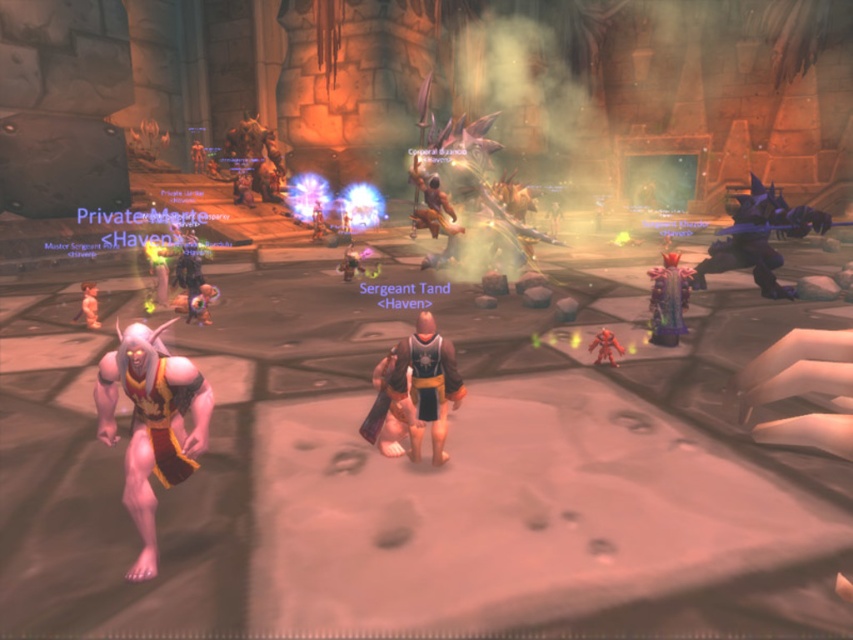
This screenshot has height=640, width=853. Describe the element at coordinates (389, 410) in the screenshot. I see `brown leather belt at center` at that location.

Does point (386, 404) lie in front of point (206, 291)?

Yes.

Between point (404, 412) and point (187, 310), which one is positioned in front?

Point (404, 412) is in front.

In order to click on brown leather belt at center in this screenshot , I will do `click(389, 410)`.

Is orange fabric demon at lower left to the right of shiny blue armor at right from the viewer's perspective?

No, orange fabric demon at lower left is not to the right of shiny blue armor at right.

Between orange fabric demon at lower left and shiny blue armor at right, which one has more height?

shiny blue armor at right

Between point (200, 433) and point (766, 250), which one is positioned behind?

Point (766, 250)

This screenshot has height=640, width=853. What are the coordinates of `orange fabric demon at lower left` in the screenshot? It's located at (151, 422).

Who is more forward, (193, 317) or (611, 364)?

Point (611, 364) is more forward.

Can you confirm if shiny plastic toy at center is positioned below shiny red toy at lower right?

Actually, shiny plastic toy at center is above shiny red toy at lower right.

Is point (207, 298) positioned behind point (616, 344)?

Yes, point (207, 298) is farther from viewer.

Find the location of a particular element. The width and height of the screenshot is (853, 640). shiny plastic toy at center is located at coordinates (201, 304).